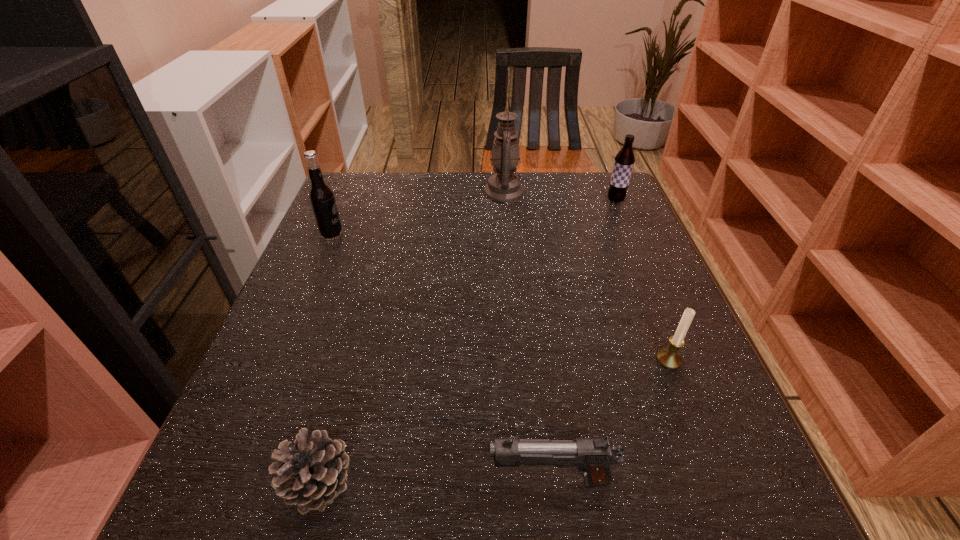
The image size is (960, 540). What are the coordinates of `oil lamp` in the screenshot? It's located at (504, 186).

The width and height of the screenshot is (960, 540). In order to click on the left root beer in this screenshot , I will do `click(321, 196)`.

Where is `the leftmost object`? This screenshot has width=960, height=540. the leftmost object is located at coordinates (321, 196).

Where is `the right root beer`? This screenshot has width=960, height=540. the right root beer is located at coordinates (624, 161).

Locate an element on the screen. The image size is (960, 540). the shorter root beer is located at coordinates (624, 161).

Locate an element on the screen. candle holder is located at coordinates (669, 358).

Where is `gun`? gun is located at coordinates (593, 456).

Find the location of a particular element. pinecone is located at coordinates pyautogui.click(x=311, y=473).

Where is `free space located 0.080m on the left of the tallest object`? free space located 0.080m on the left of the tallest object is located at coordinates (456, 191).

You are a GUI agent. You are given a task and a screenshot of the screen. Output one action in this format:
    pyautogui.click(x=<x>, y=<y>)
    Task: Click on the vacant point located on the label of the fifth shortest object
    This screenshot has height=540, width=960.
    Given the screenshot: What is the action you would take?
    pyautogui.click(x=383, y=235)